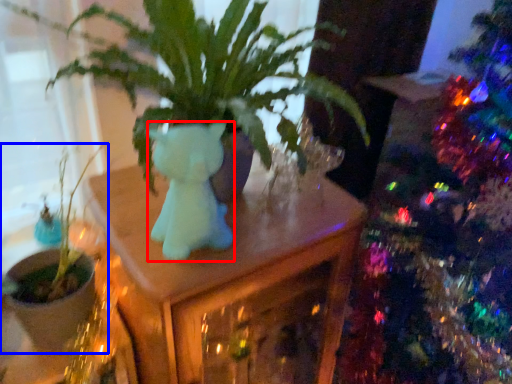
Question: Which object appears farthest to the camera in this image, animal (highlighted by a red box) or houseplant (highlighted by a blue box)?

Choices:
 (A) animal
 (B) houseplant

Answer: (B)